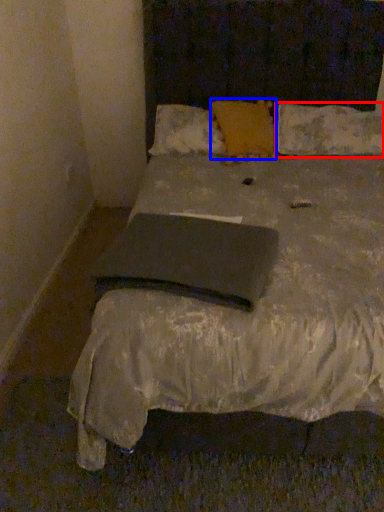
Question: Among these objects, which one is farthest to the camera, pillow (highlighted by a red box) or pillow (highlighted by a blue box)?

Choices:
 (A) pillow
 (B) pillow

Answer: (A)